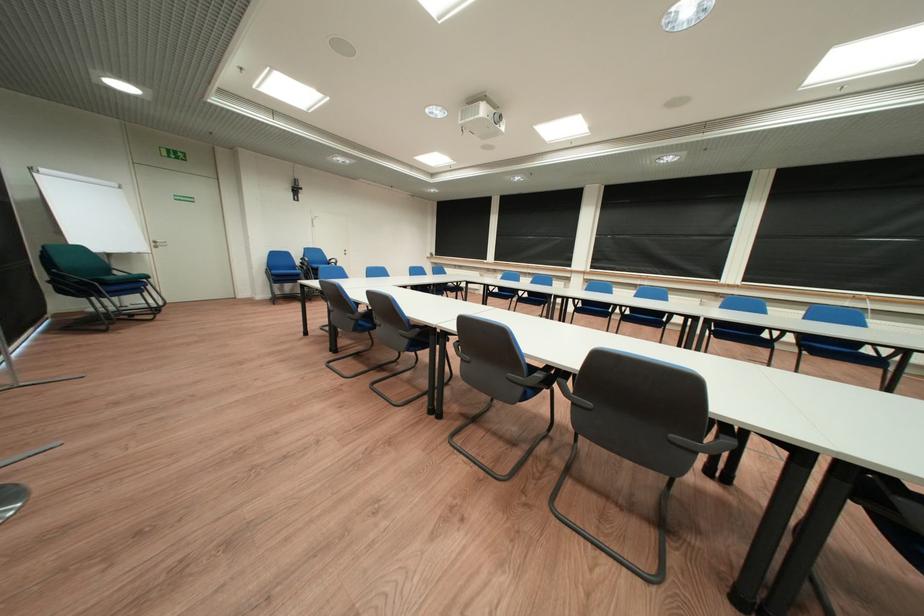
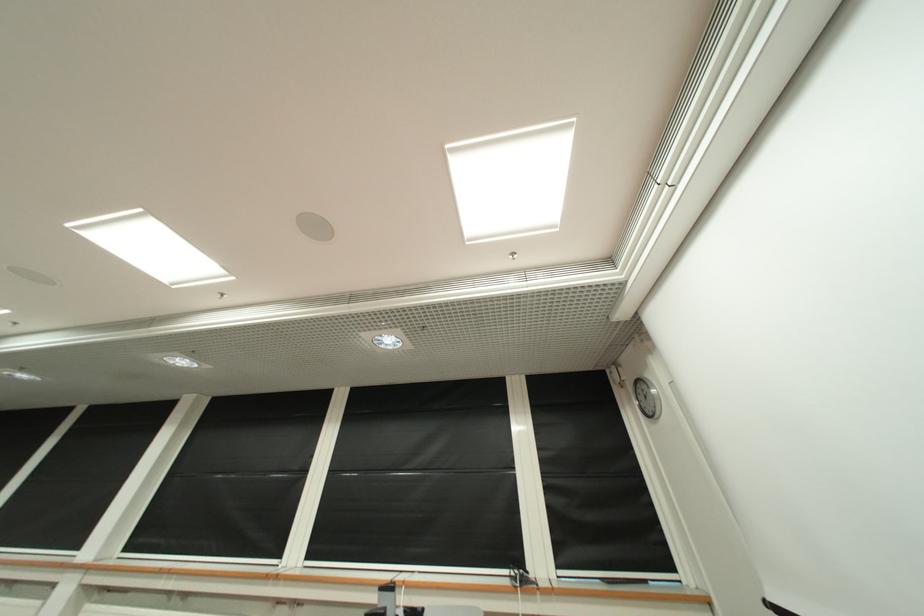
Locate, in the second image, the point that corresponds to pixel 757 283 in the first image.

(321, 560)